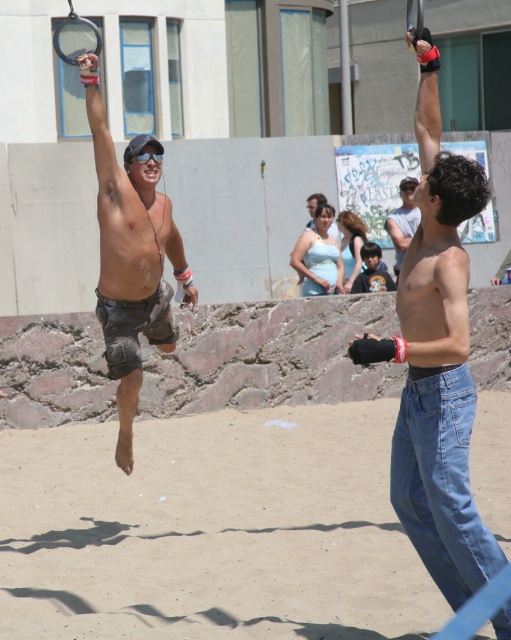
Question: Where is denim jeans at center located in relation to dark blue shirt at center in the image?

Choices:
 (A) below
 (B) above

Answer: (A)

Question: In this image, where is denim jeans at center located relative to denim shorts at center?

Choices:
 (A) above
 (B) below

Answer: (B)

Question: Which point is closer to the camera taking this photo?

Choices:
 (A) (365, 259)
 (B) (99, 602)
 (C) (125, 237)

Answer: (B)

Question: Which point is farther to the camera?

Choices:
 (A) matte black shorts at left
 (B) dark blue shirt at center

Answer: (B)

Question: From the image, what is the correct spatial relationship of denim jeans at center in relation to denim shorts at center?

Choices:
 (A) above
 (B) below

Answer: (B)

Question: Which object is the closest to the matte black shorts at left?

Choices:
 (A) dark blue shirt at center
 (B) denim shorts at center
 (C) sandy beach at lower center
 (D) denim jeans at center

Answer: (C)